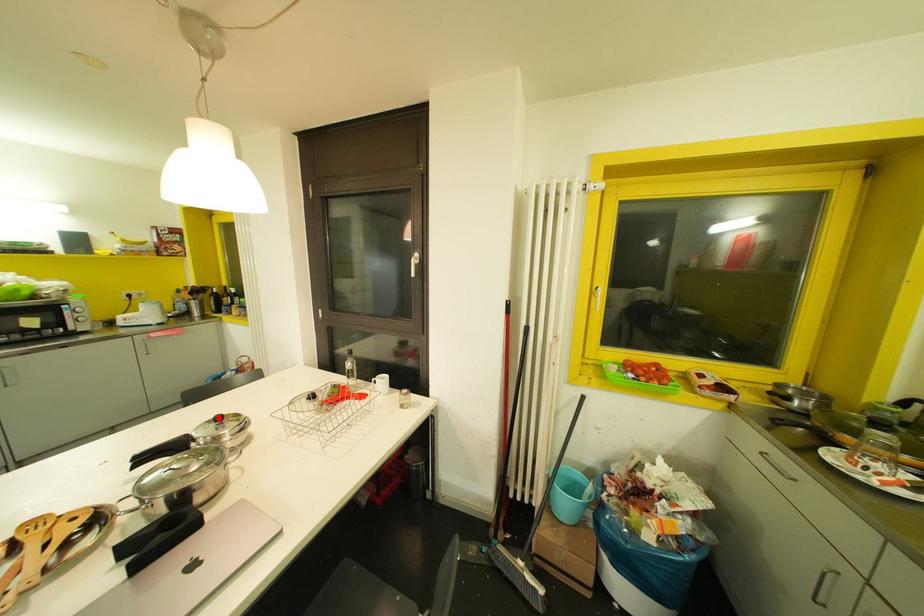
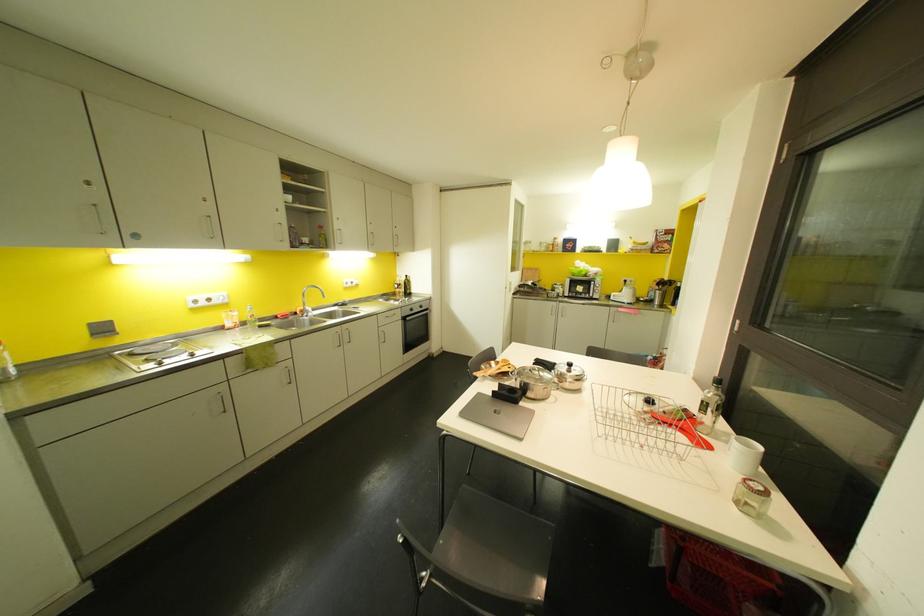
In the second image, find the point that corresponds to the highlighted location in the first image.

(569, 363)